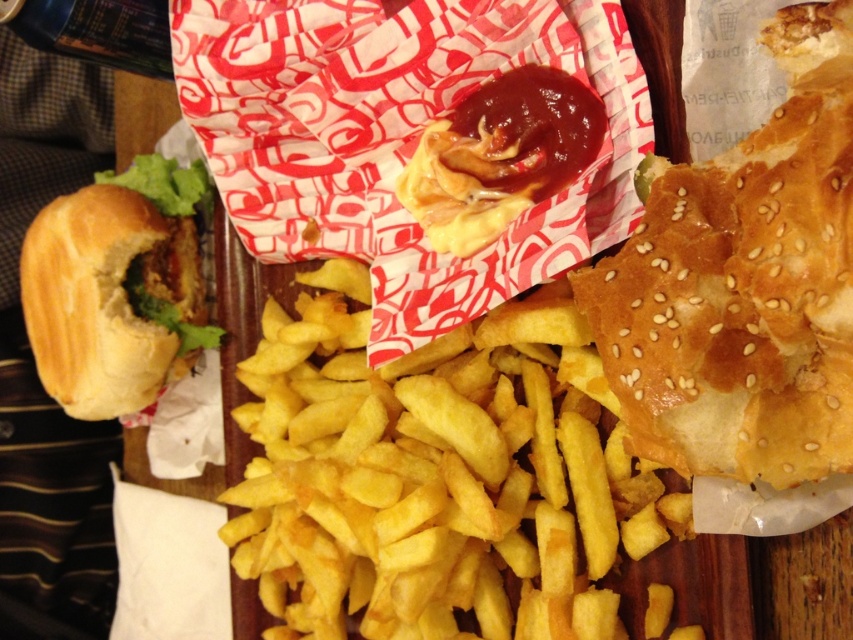
The width and height of the screenshot is (853, 640). What do you see at coordinates (430, 481) in the screenshot?
I see `golden crispy french fries at center` at bounding box center [430, 481].

Does golden crispy french fries at center appear on the left side of sesame seed bun at right?

Correct, you'll find golden crispy french fries at center to the left of sesame seed bun at right.

Which is in front, point (335, 595) or point (635, 390)?

Positioned in front is point (635, 390).

The height and width of the screenshot is (640, 853). I want to click on golden crispy french fries at center, so click(430, 481).

Can you confirm if sesame seed bun at right is shorter than slightly toasted bun with lettuce at left?

Yes.

Can you confirm if sesame seed bun at right is bigger than slightly toasted bun with lettuce at left?

No.

Measure the distance between point (846,257) and camera.

The distance of point (846,257) from camera is 23.16 inches.

The height and width of the screenshot is (640, 853). What are the coordinates of `sesame seed bun at right` in the screenshot? It's located at (744, 288).

Image resolution: width=853 pixels, height=640 pixels. What are the coordinates of `golden crispy french fries at center` in the screenshot? It's located at (430, 481).

I want to click on golden crispy french fries at center, so click(x=430, y=481).